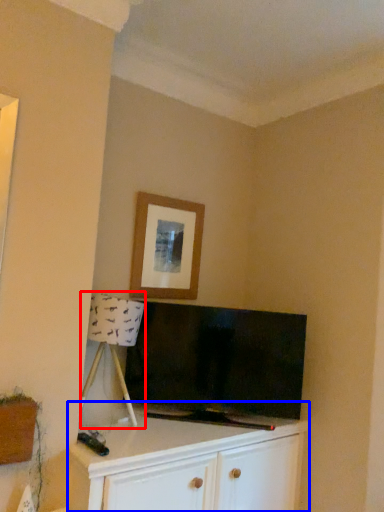
Question: Which object appears closest to the camera in this image, lamp (highlighted by a red box) or cabinetry (highlighted by a blue box)?

Choices:
 (A) lamp
 (B) cabinetry

Answer: (B)